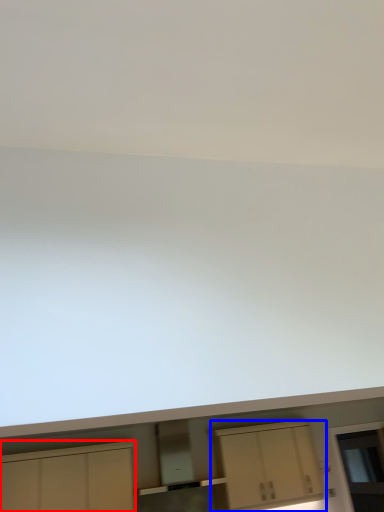
Question: Which object is closer to the camera taking this photo, cabinetry (highlighted by a red box) or cabinetry (highlighted by a blue box)?

Choices:
 (A) cabinetry
 (B) cabinetry

Answer: (A)